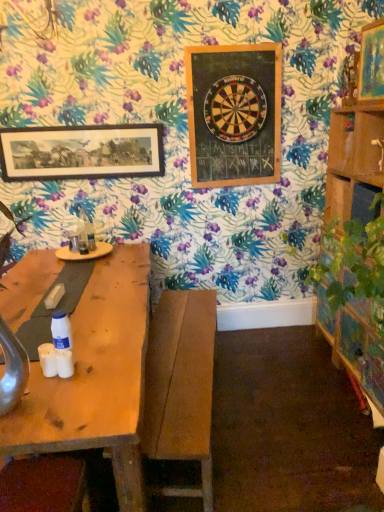
Find the location of `vacant area on top of wooden framed print at upper left, the 3th picture frame when ordered from front to back (from a real-world perspective)`. vacant area on top of wooden framed print at upper left, the 3th picture frame when ordered from front to back (from a real-world perspective) is located at coordinates (77, 125).